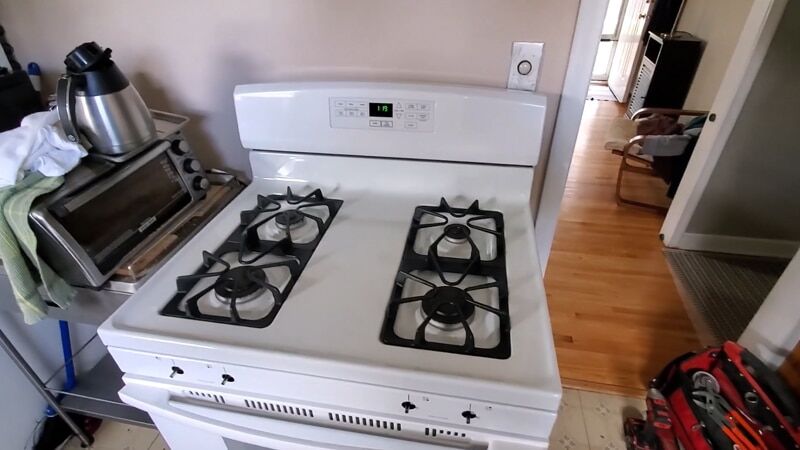
This screenshot has height=450, width=800. I want to click on clock, so coord(378,108).